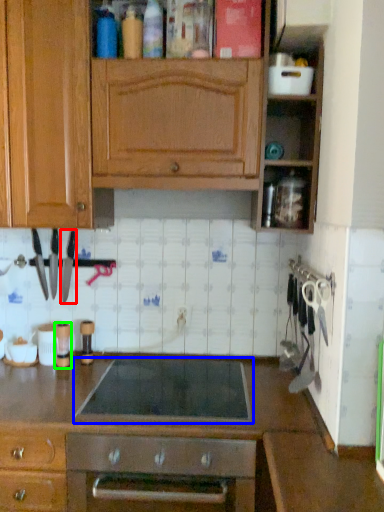
Question: Which is farther away from kitchen appliance (highlighted by a red box)? gas stove (highlighted by a blue box) or appliance (highlighted by a green box)?

Choices:
 (A) gas stove
 (B) appliance

Answer: (A)